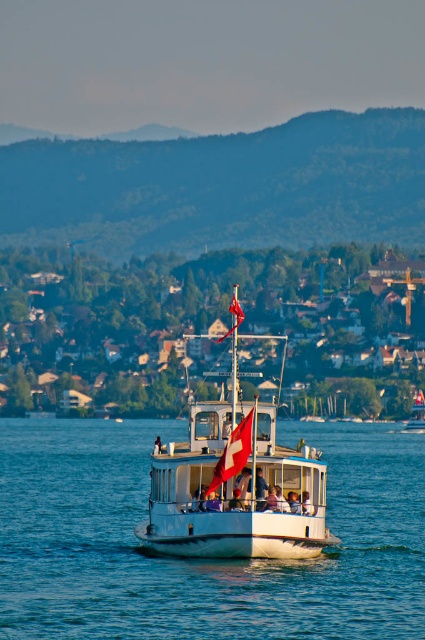
You are a passenger on the white glossy boat at center. You want to know your current position relative to the center of the image. What is your location in terms of coordinates?

The white glossy boat at center is located at coordinates (235,486).